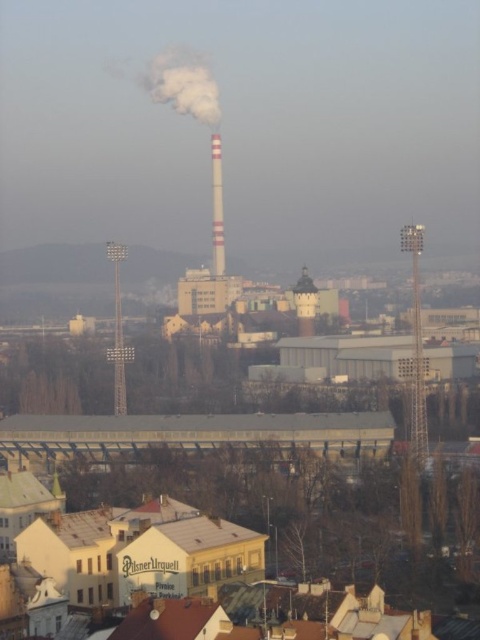
Question: Among these points, which one is nearest to the camera?

Choices:
 (A) (204, 108)
 (B) (220, 164)
 (C) (299, 296)

Answer: (C)

Question: Which point is closer to the camera taking this photo?

Choices:
 (A) (180, 81)
 (B) (222, 266)

Answer: (B)

Question: Which of the following is the farthest from the observer?

Choices:
 (A) (211, 140)
 (B) (303, 300)
 (C) (202, 120)

Answer: (C)

Question: From the image, what is the correct spatial relationship of white smoke at upper center in relation to smooth white chimney at center?

Choices:
 (A) above
 (B) below

Answer: (A)

Question: Is the position of white glossy chimney at center more distant than that of smooth white chimney at center?

Choices:
 (A) no
 (B) yes

Answer: (B)

Question: Is white smoke at upper center wider than smooth white chimney at center?

Choices:
 (A) yes
 (B) no

Answer: (A)